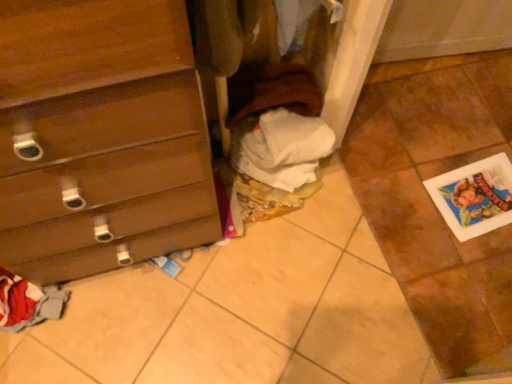
What is the approximate height of brown cotton sweater at center?

6.20 inches.

This screenshot has height=384, width=512. Find the location of `brown cotton sweater at center`. brown cotton sweater at center is located at coordinates (282, 93).

You are a GUI agent. You are given a task and a screenshot of the screen. Output one action in this format:
    pyautogui.click(x=<x>, y=<y>)
    Task: Click on the wooden chest of drawers at left
    
    Given the screenshot: What is the action you would take?
    pyautogui.click(x=100, y=136)

What do you see at coordinates (100, 136) in the screenshot?
I see `wooden chest of drawers at left` at bounding box center [100, 136].

This screenshot has width=512, height=384. What are the coordinates of `white paper at lower right` in the screenshot? It's located at (474, 196).

Looking at this image, from a real-world perspective, is brown cotton sweater at center positioned under wooden chest of drawers at left based on gravity?

Yes, from a real-world perspective, brown cotton sweater at center is under wooden chest of drawers at left.

Considering their positions, is brown cotton sweater at center located in front of or behind wooden chest of drawers at left?

Clearly, brown cotton sweater at center is behind wooden chest of drawers at left.

Is brown cotton sweater at center with wooden chest of drawers at left?

brown cotton sweater at center is not next to wooden chest of drawers at left, and they're not touching.

Do you think wooden chest of drawers at left is within brown cotton sweater at center, or outside of it?

wooden chest of drawers at left lies outside brown cotton sweater at center.

Is point (101, 260) closer to viewer compared to point (270, 93)?

Yes.

From a real-world perspective, relative to brown cotton sweater at center, is wooden chest of drawers at left vertically above or below?

In terms of real-world spatial position, wooden chest of drawers at left is above brown cotton sweater at center.

From the picture: Does wooden chest of drawers at left appear on the left side of brown cotton sweater at center?

Yes.

From a real-world perspective, which object rests below the other?

In real-world perspective, white paper at lower right is lower.

Can you confirm if white paper at lower right is smaller than brown cotton sweater at center?

Indeed, white paper at lower right has a smaller size compared to brown cotton sweater at center.

Is white paper at lower right oriented away from brown cotton sweater at center?

No.

Based on the photo, is brown cotton sweater at center further to the viewer compared to white paper at lower right?

No, the depth of brown cotton sweater at center is less than that of white paper at lower right.

From the image's perspective, is brown cotton sweater at center under white paper at lower right?

Actually, brown cotton sweater at center appears above white paper at lower right in the image.

Between brown cotton sweater at center and white paper at lower right, which one appears on the right side from the viewer's perspective?

white paper at lower right is more to the right.

Is brown cotton sweater at center aimed at white paper at lower right?

No, brown cotton sweater at center is not turned towards white paper at lower right.

Would you say wooden chest of drawers at left is a long distance from white paper at lower right?

Actually, wooden chest of drawers at left and white paper at lower right are a little close together.

Which of these two, wooden chest of drawers at left or white paper at lower right, is wider?

wooden chest of drawers at left is wider.

Does wooden chest of drawers at left turn towards white paper at lower right?

No.

Considering the positions of objects wooden chest of drawers at left and white paper at lower right in the image provided, who is behind, wooden chest of drawers at left or white paper at lower right?

white paper at lower right is behind.

Is white paper at lower right to the right of wooden chest of drawers at left from the viewer's perspective?

Yes, white paper at lower right is to the right of wooden chest of drawers at left.

Is white paper at lower right taller than wooden chest of drawers at left?

Incorrect, the height of white paper at lower right is not larger of that of wooden chest of drawers at left.

Locate an element on the screen. postcard that is on the right side of wooden chest of drawers at left is located at coordinates (474, 196).

Does point (480, 222) come farther from viewer compared to point (169, 182)?

Yes, point (480, 222) is behind point (169, 182).

The width and height of the screenshot is (512, 384). I want to click on chest of drawers on the left of brown cotton sweater at center, so click(100, 136).

At what (x,y) coordinates should I click in order to perform the action: click on the chest of drawers lying in front of the brown cotton sweater at center. Please return your answer as a coordinate pair (x, y). The image size is (512, 384). Looking at the image, I should click on (100, 136).

From the image, which object appears to be farther from wooden chest of drawers at left, brown cotton sweater at center or white paper at lower right?

Based on the image, white paper at lower right appears to be further to wooden chest of drawers at left.

Estimate the real-world distances between objects in this image. Which object is further from wooden chest of drawers at left, white paper at lower right or brown cotton sweater at center?

white paper at lower right is positioned further to the anchor wooden chest of drawers at left.

Based on their spatial positions, is brown cotton sweater at center or wooden chest of drawers at left further from white paper at lower right?

Based on the image, wooden chest of drawers at left appears to be further to white paper at lower right.

Based on their spatial positions, is white paper at lower right or wooden chest of drawers at left further from brown cotton sweater at center?

white paper at lower right is positioned further to the anchor brown cotton sweater at center.

Estimate the real-world distances between objects in this image. Which object is closer to brown cotton sweater at center, wooden chest of drawers at left or white paper at lower right?

The object closer to brown cotton sweater at center is wooden chest of drawers at left.

Estimate the real-world distances between objects in this image. Which object is closer to white paper at lower right, wooden chest of drawers at left or brown cotton sweater at center?

brown cotton sweater at center is closer to white paper at lower right.

What are the coordinates of `clothing between wooden chest of drawers at left and white paper at lower right in the horizontal direction` in the screenshot? It's located at click(x=282, y=93).